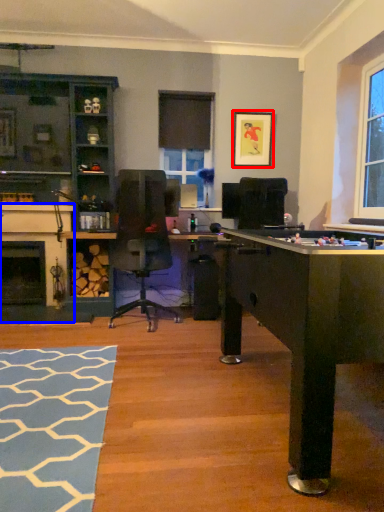
Question: Which object appears closest to the camera in this image, picture frame (highlighted by a red box) or fireplace (highlighted by a blue box)?

Choices:
 (A) picture frame
 (B) fireplace

Answer: (B)